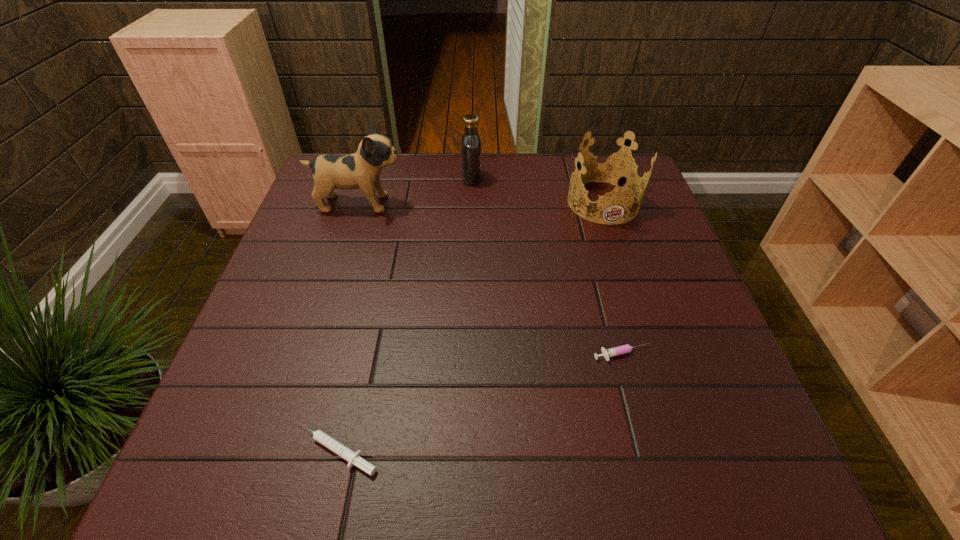
You are a GUI agent. You are given a task and a screenshot of the screen. Output one action in this format:
    pyautogui.click(x=<x>, y=<y>)
    Task: Click on the object situated at the far right corner
    
    Given the screenshot: What is the action you would take?
    pyautogui.click(x=612, y=167)

Locate an element on the screen. The width and height of the screenshot is (960, 540). free space at the far edge of the desktop is located at coordinates (419, 196).

Where is `vacant space at the left edge`? Image resolution: width=960 pixels, height=540 pixels. vacant space at the left edge is located at coordinates (282, 299).

Identify the location of vacant space at the right edge of the desktop. (640, 285).

The image size is (960, 540). Find the location of `vacant space in between the left syringe and the second nearest object`. vacant space in between the left syringe and the second nearest object is located at coordinates (479, 402).

I want to click on free space between the puppy and the fourth farthest object, so coord(491,279).

Locate an element on the screen. vacant area between the puppy and the right syringe is located at coordinates (491, 279).

Where is `free spot between the puppy and the crown`? free spot between the puppy and the crown is located at coordinates (481, 202).

Where is `free point between the crown and the tallest object`? The height and width of the screenshot is (540, 960). free point between the crown and the tallest object is located at coordinates (481, 202).

Find the location of a particular element. The image size is (960, 540). unoccupied position between the nearer syringe and the farther syringe is located at coordinates (479, 402).